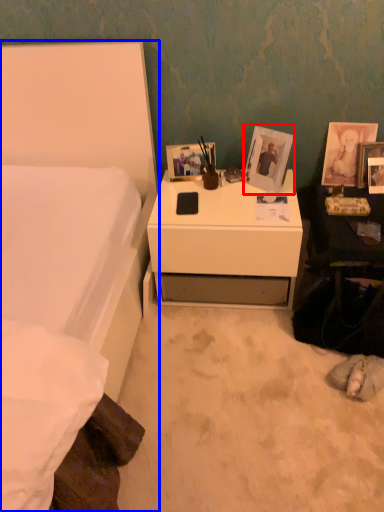
Question: Among these objects, which one is nearest to the camera, picture frame (highlighted by a red box) or bed (highlighted by a blue box)?

Choices:
 (A) picture frame
 (B) bed

Answer: (B)